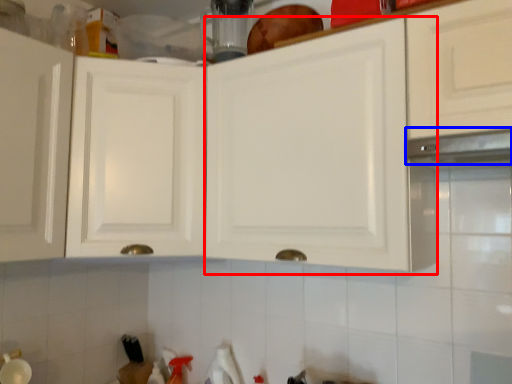
Question: Which point is further to the camera, cabinetry (highlighted by a red box) or exhaust hood (highlighted by a blue box)?

Choices:
 (A) cabinetry
 (B) exhaust hood

Answer: (A)